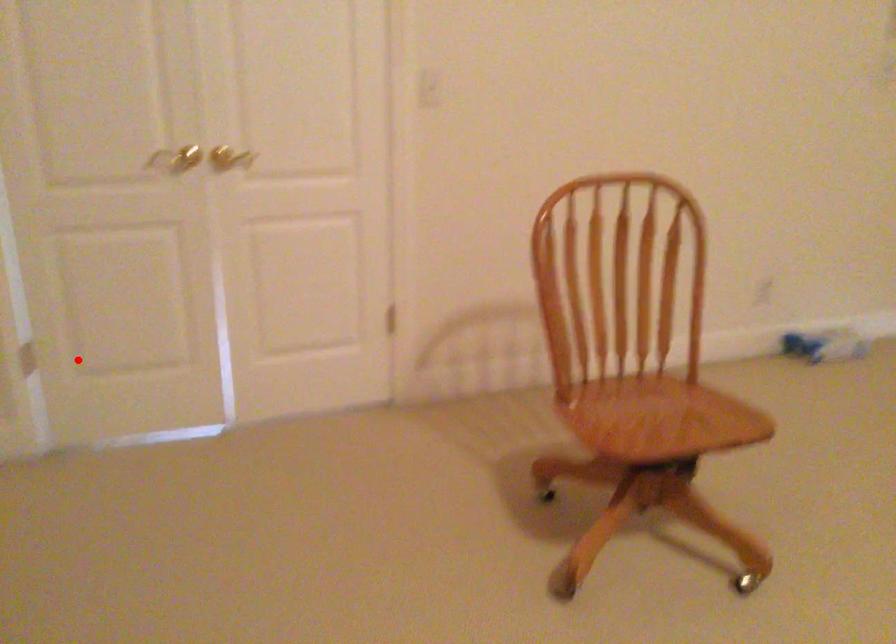
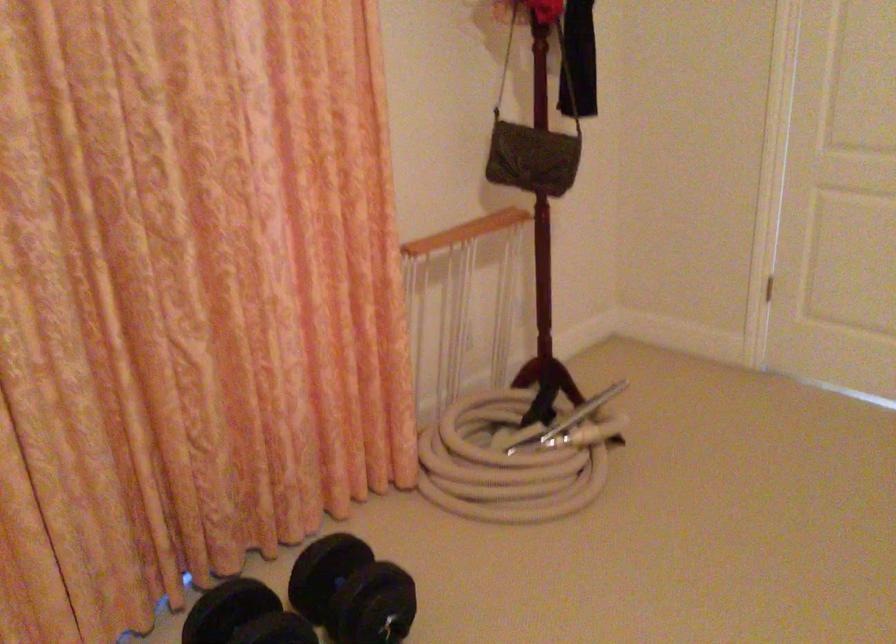
Question: I am providing you with two images of the same scene from different viewpoints. In image1, a red point is highlighted. Considering the same 3D point in image2, which of the following is correct?

Choices:
 (A) It is closer
 (B) It is farther

Answer: (B)